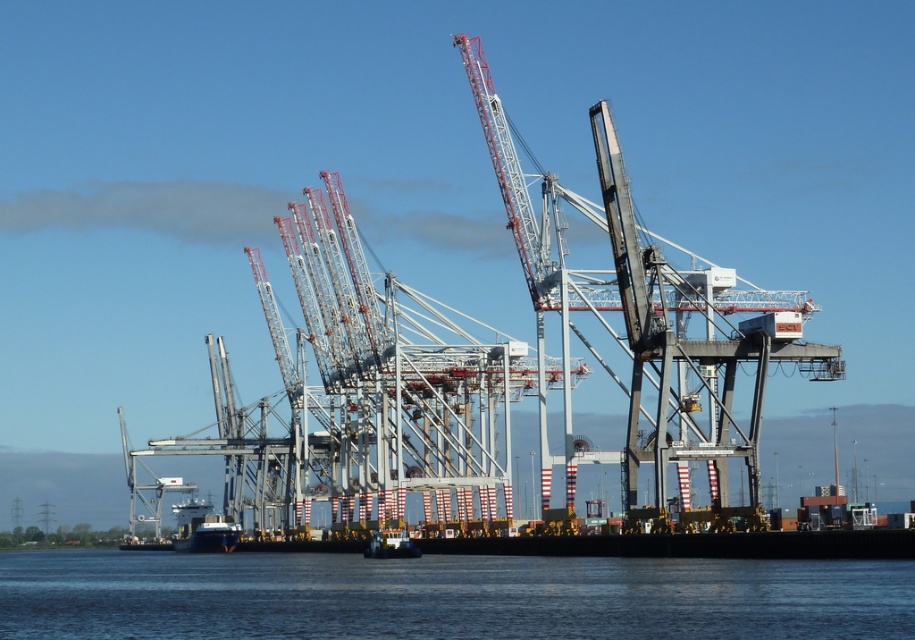
Is transparent water at center closer to camera compared to metallic gray crane at center?

That is True.

Does point (321, 582) come in front of point (490, 129)?

Yes, it is.

This screenshot has height=640, width=915. I want to click on transparent water at center, so click(447, 596).

Does metallic gray crane at center appear under black matte boat at lower center?

Incorrect, metallic gray crane at center is not positioned below black matte boat at lower center.

Can you confirm if metallic gray crane at center is thinner than black matte boat at lower center?

No, metallic gray crane at center is not thinner than black matte boat at lower center.

Does point (569, 381) come behind point (225, 525)?

No.

Where is `metallic gray crane at center`? The width and height of the screenshot is (915, 640). metallic gray crane at center is located at coordinates (648, 312).

Measure the distance between transparent water at center and black matte boat at lower center.

70.85 meters

Which is behind, point (723, 589) or point (178, 513)?

Point (178, 513)

Is point (191, 595) positioned before point (216, 536)?

Yes, it is in front of point (216, 536).

Find the location of a particular element. This screenshot has width=915, height=640. transparent water at center is located at coordinates (447, 596).